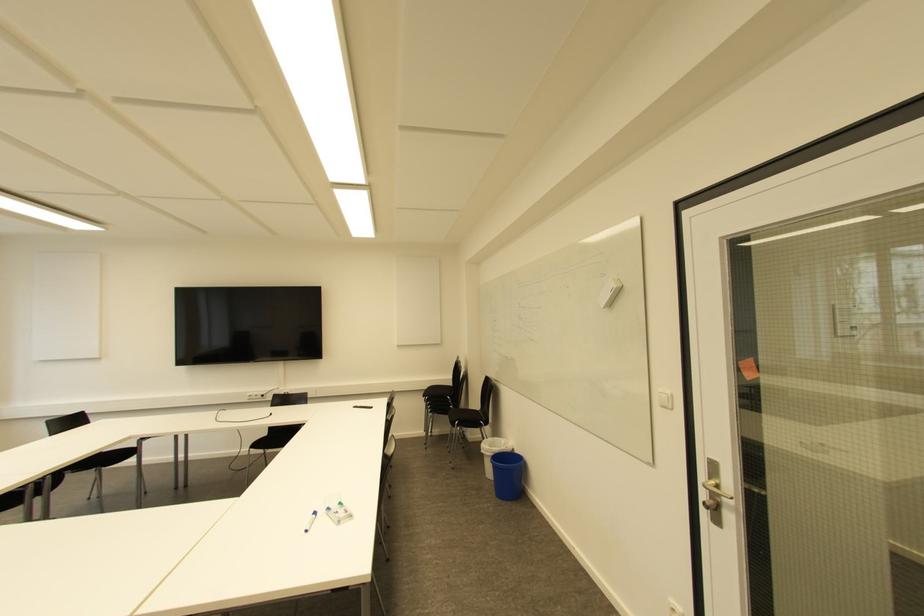
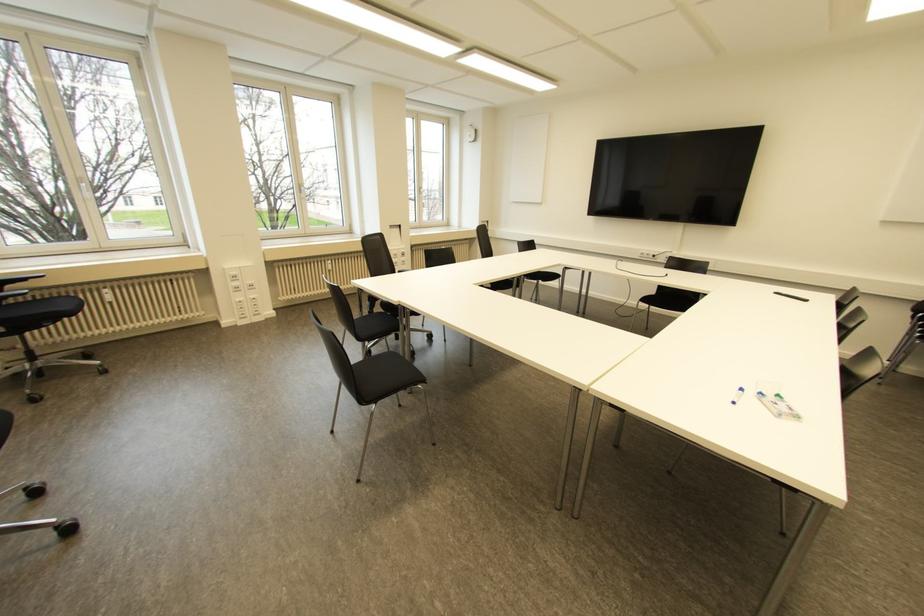
Find the pixel in the second image that matches point 339,503 in the first image.

(777, 395)